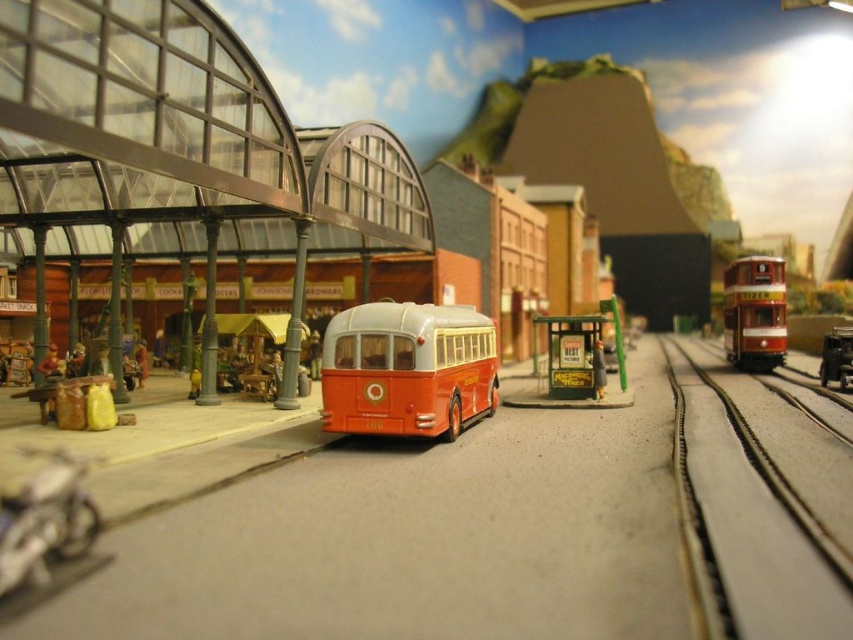
Question: Is metallic silver train tracks at right to the left of matte orange bus at center from the viewer's perspective?

Choices:
 (A) no
 (B) yes

Answer: (A)

Question: Does metallic silver train tracks at right appear on the left side of red polished wood tram at right?

Choices:
 (A) yes
 (B) no

Answer: (A)

Question: Observing the image, what is the correct spatial positioning of metallic silver train tracks at right in reference to matte orange bus at center?

Choices:
 (A) above
 (B) below

Answer: (B)

Question: Which point appears closest to the camera in this image?

Choices:
 (A) (691, 518)
 (B) (762, 275)
 (C) (392, 410)

Answer: (A)

Question: Which object is farther from the camera taking this photo?

Choices:
 (A) matte orange bus at center
 (B) red polished wood tram at right

Answer: (B)

Question: Which of the following is the closest to the observer?

Choices:
 (A) metallic silver train tracks at right
 (B) matte orange bus at center
 (C) red polished wood tram at right

Answer: (A)